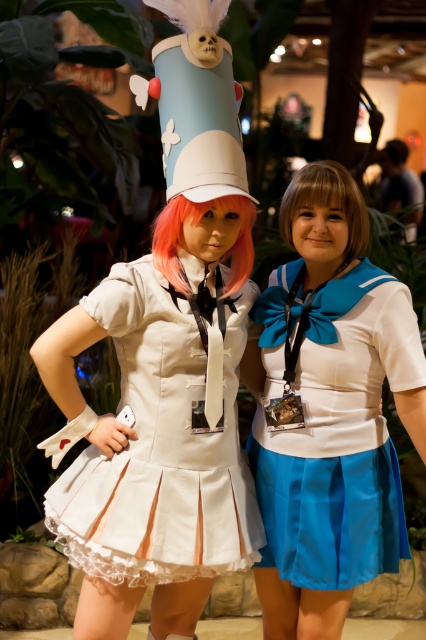
Question: Which of the following is the farthest from the observer?

Choices:
 (A) (161, 316)
 (B) (363, 324)

Answer: (B)

Question: Which point appears farthest from the camera in this image?

Choices:
 (A) (236, 438)
 (B) (339, 474)

Answer: (A)

Question: Observing the image, what is the correct spatial positioning of white satin dress at center in reference to satin blue skirt at center?

Choices:
 (A) right
 (B) left

Answer: (B)

Question: From the image, what is the correct spatial relationship of white satin dress at center in relation to satin blue skirt at center?

Choices:
 (A) below
 (B) above

Answer: (B)

Question: Which point appears closest to the camera in this image?

Choices:
 (A) (276, 508)
 (B) (247, 499)

Answer: (B)

Question: Is white satin dress at center to the right of satin blue skirt at center from the viewer's perspective?

Choices:
 (A) yes
 (B) no

Answer: (B)